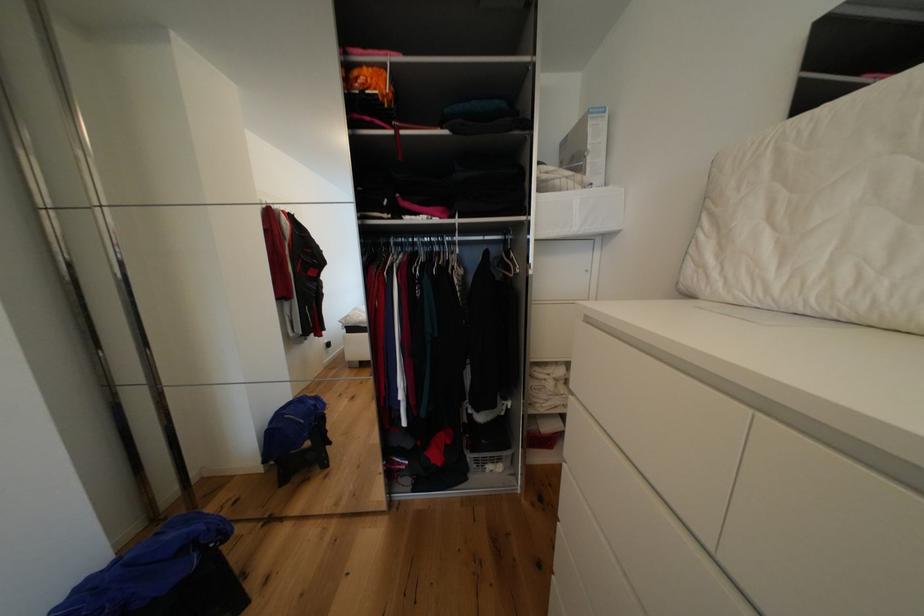
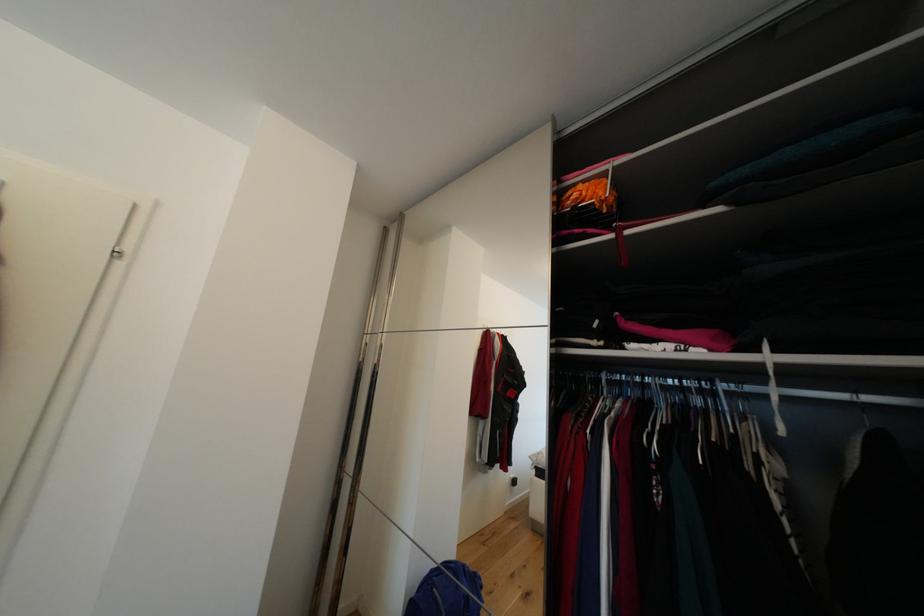
In the second image, find the point that corresponds to (462,225) in the first image.

(769, 367)